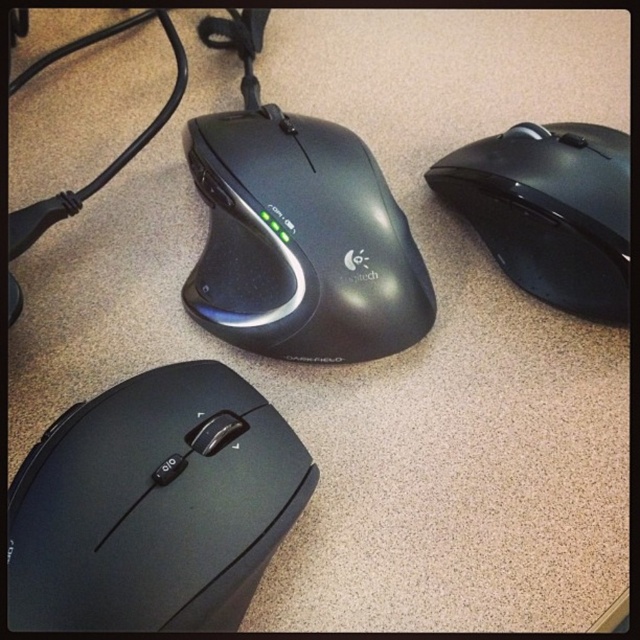
Question: Can you confirm if black matte mouse at center is smaller than black glossy mouse at upper right?

Choices:
 (A) no
 (B) yes

Answer: (B)

Question: Can you confirm if black matte/black textured mouse at lower left is bigger than black matte mouse at center?

Choices:
 (A) no
 (B) yes

Answer: (B)

Question: Is the position of black matte/black textured mouse at lower left more distant than that of black glossy mouse at upper right?

Choices:
 (A) no
 (B) yes

Answer: (A)

Question: Which point is farther from the camera taking this photo?

Choices:
 (A) (112, 506)
 (B) (312, 164)

Answer: (B)

Question: Which object is closer to the camera taking this photo?

Choices:
 (A) black matte/black textured mouse at lower left
 (B) black glossy mouse at upper right

Answer: (A)

Question: Which of the following is the closest to the observer?

Choices:
 (A) (604, 154)
 (B) (193, 474)
 (C) (337, 339)

Answer: (B)